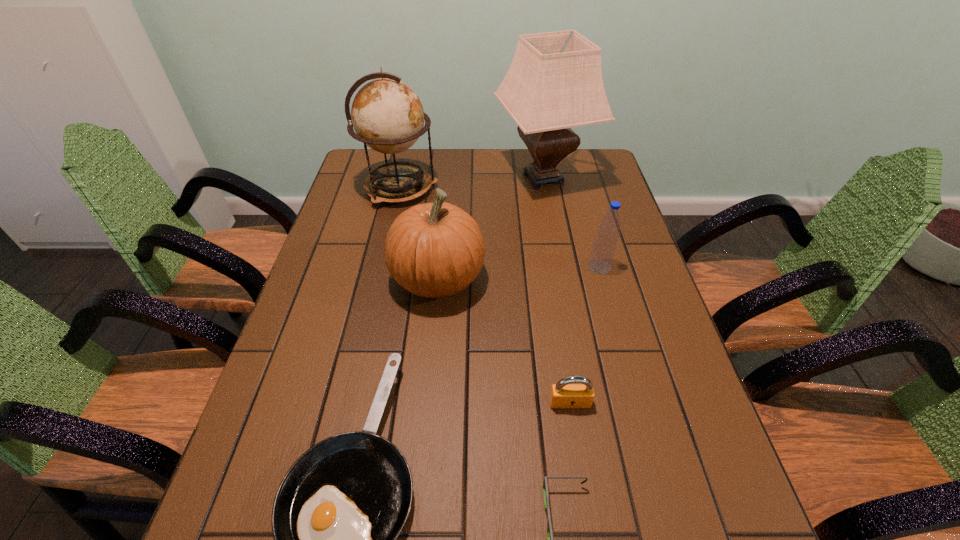
Identify the location of lampshade located in the far edge section of the desktop. This screenshot has width=960, height=540. (554, 83).

Find the location of a particular element. This screenshot has width=960, height=540. globe present at the far edge is located at coordinates (387, 115).

Where is `object situated at the left edge`? object situated at the left edge is located at coordinates (387, 115).

You are a GUI agent. You are given a task and a screenshot of the screen. Output one action in this format:
    pyautogui.click(x=<x>, y=<y>)
    Task: Click on the lampshade that is at the right edge
    This screenshot has width=960, height=540.
    Given the screenshot: What is the action you would take?
    pyautogui.click(x=554, y=83)

The width and height of the screenshot is (960, 540). Identify the location of water bottle that is at the right edge. (604, 247).

Locate an element on the screen. object that is at the far left corner is located at coordinates (387, 115).

Where is `object located at the far right corner`? object located at the far right corner is located at coordinates (554, 83).

At what (x,y) coordinates should I click in order to perform the action: click on free region at the far edge of the desktop. Please return your answer as a coordinate pair (x, y). The width and height of the screenshot is (960, 540). Looking at the image, I should click on (455, 170).

In order to click on vacant space at the left edge of the desktop in this screenshot , I will do `click(334, 401)`.

Where is `blank space at the right edge`? blank space at the right edge is located at coordinates (619, 337).